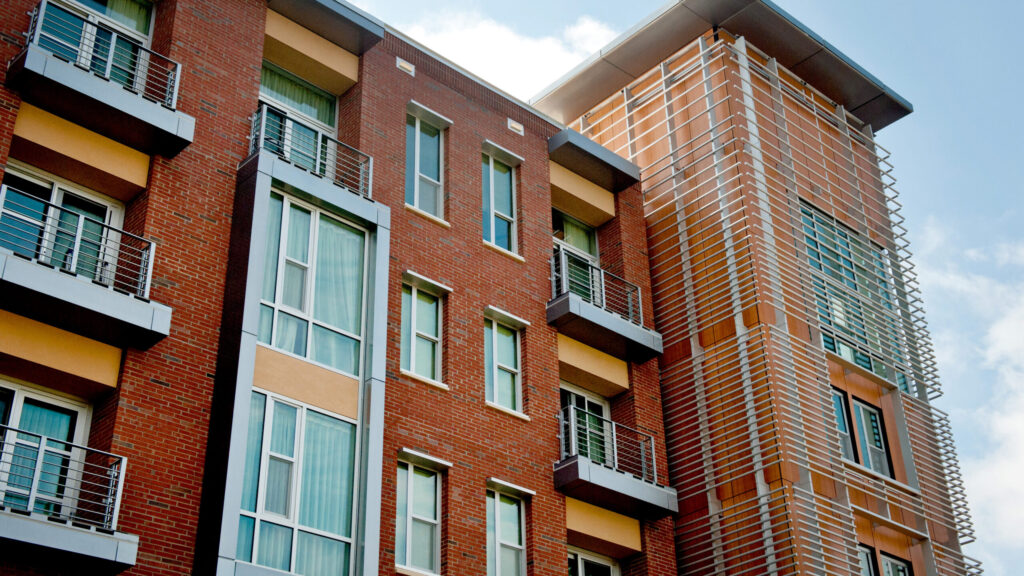
The width and height of the screenshot is (1024, 576). Identify the location of lights. (398, 66), (512, 128).